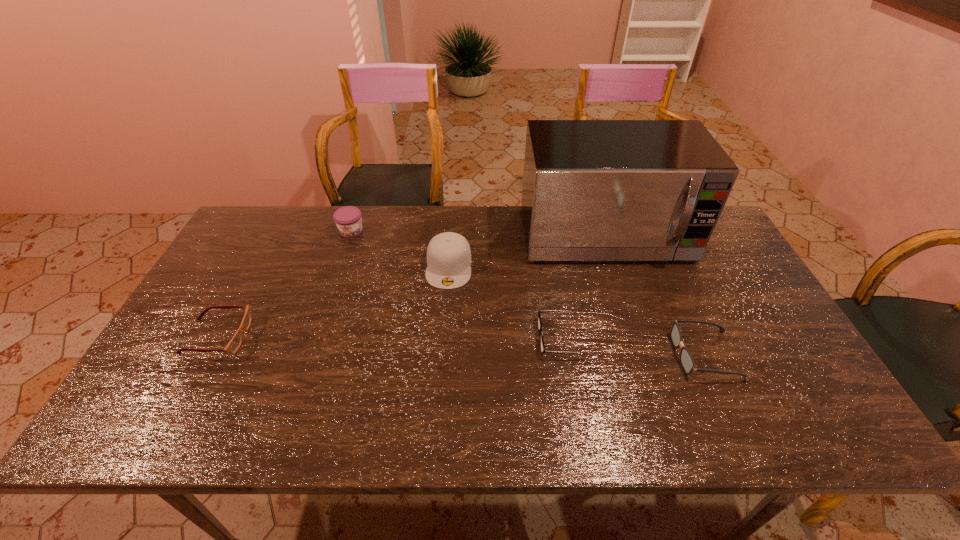
Locate an element on the screen. free spot between the third object from left to right and the rightmost spectacles is located at coordinates (577, 310).

Where is `vacant region between the microwave oven and the second spectacles from right to left`? vacant region between the microwave oven and the second spectacles from right to left is located at coordinates (583, 287).

The image size is (960, 540). Find the location of `free space between the rightmost spectacles and the shortest spectacles`. free space between the rightmost spectacles and the shortest spectacles is located at coordinates tap(633, 346).

This screenshot has height=540, width=960. Identify the location of free space between the second shortest spectacles and the shortest object. (389, 337).

This screenshot has width=960, height=540. What are the coordinates of `vacant point located between the fourth object from right to left and the rightmost spectacles` in the screenshot? It's located at (577, 310).

Identify the location of free space between the third object from left to right and the shortest spectacles. The width and height of the screenshot is (960, 540). (504, 302).

Locate an element on the screen. Image resolution: width=960 pixels, height=540 pixels. vacant space that's between the fifth object from right to left and the rightmost spectacles is located at coordinates (528, 293).

At what (x,y) coordinates should I click in order to perform the action: click on unoccupied position between the cap and the jam. Please return your answer as a coordinate pair (x, y). Looking at the image, I should click on (400, 248).

Find the location of a particular element. vacant area that lies between the fifth tallest object and the shortest object is located at coordinates (389, 337).

Choose which object is the fifth nearest neighbor to the microwave oven. Please provide its 2D coordinates. Your answer should be formatted as a tuple, i.e. [(x, y)], where the tuple contains the x and y coordinates of a point satisfying the conditions above.

[(234, 344)]